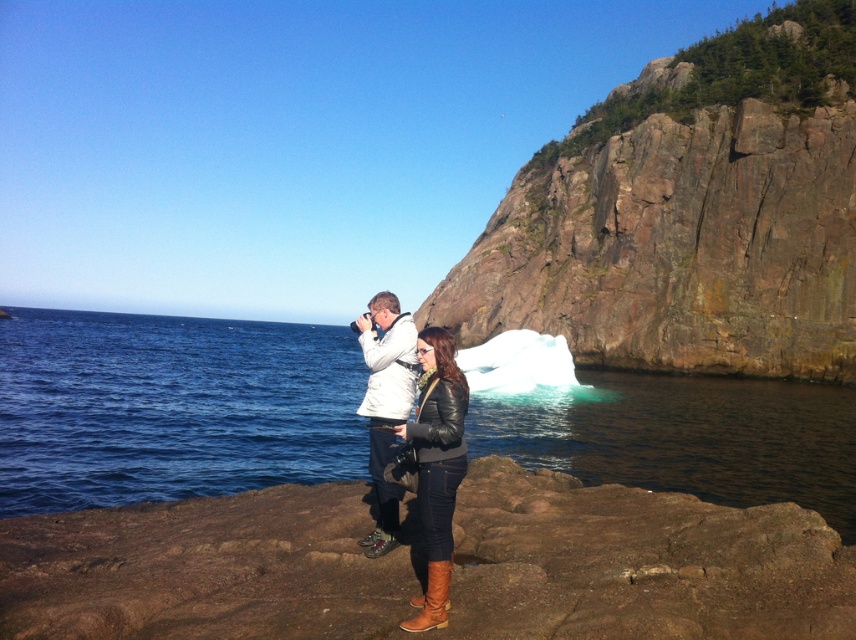
You are a photographer trying to capture a shot of the rugged stone cliff at upper right and the brown leather jacket at center. Based on their positions, which object is located to the right of the other?

The rugged stone cliff at upper right is positioned on the right side of brown leather jacket at center, so the rugged stone cliff at upper right is to the right of the brown leather jacket at center.

You are planning to take a photo of the rugged stone cliff at upper right and the white matte jacket at center. Which object should you focus on first if you want to capture both in the same frame without moving the camera?

The rugged stone cliff at upper right is much taller than the white matte jacket at center, so you should focus on the rugged stone cliff at upper right first to ensure it fits entirely within the frame.

You are a photographer planning to capture a landscape shot that includes both the rugged stone cliff at upper right and the white matte jacket at center. Based on their sizes, can you fit both into the frame without zooming in?

The rugged stone cliff at upper right might be wider than the white matte jacket at center, so there is a possibility that both can be included in the frame depending on the camera angle and distance. However, since the cliff could be wider, ensure you position yourself to capture the full width of the cliff while still including the jacket in the composition.